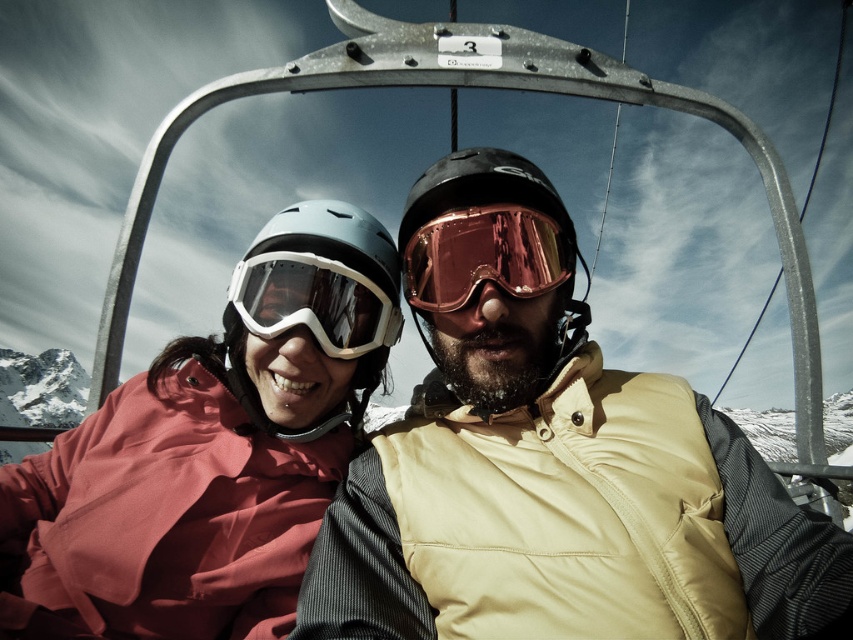
Does matte gray helmet at center have a lesser width compared to transparent matte ski goggles at center?

Incorrect, matte gray helmet at center's width is not less than transparent matte ski goggles at center's.

From the picture: Can you confirm if matte gray helmet at center is positioned to the left of transparent matte ski goggles at center?

Indeed, matte gray helmet at center is positioned on the left side of transparent matte ski goggles at center.

Does point (270, 240) lie in front of point (390, 330)?

Yes, it is in front of point (390, 330).

I want to click on matte gray helmet at center, so click(317, 298).

Who is more distant from viewer, (355, 310) or (511, 177)?

Positioned behind is point (355, 310).

In the scene shown: Can you confirm if matte gray helmet at center is bigger than glossy plastic helmet at center?

Incorrect, matte gray helmet at center is not larger than glossy plastic helmet at center.

Find the location of a particular element. matte gray helmet at center is located at coordinates (317, 298).

I want to click on matte gray helmet at center, so click(317, 298).

Is point (212, 493) more distant than point (235, 300)?

No, it is in front of (235, 300).

Between point (370, 364) and point (329, 355), which one is positioned behind?

The point (370, 364) is behind.

Which is in front, point (247, 424) or point (271, 289)?

Point (271, 289) is in front.

Where is `matte pink jacket at left`? The height and width of the screenshot is (640, 853). matte pink jacket at left is located at coordinates (212, 451).